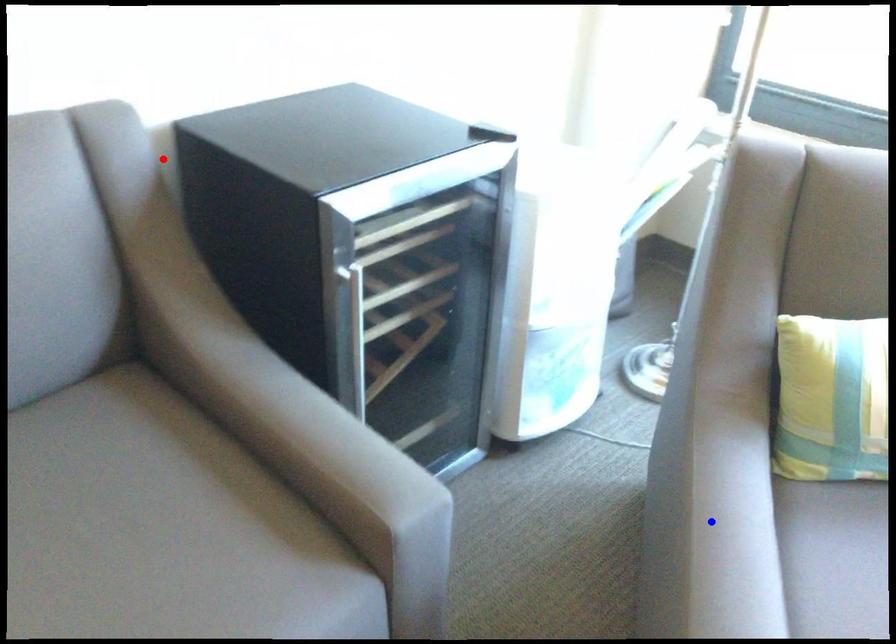
Question: Two points are marked on the image. Which point is closer to the camera?

Choices:
 (A) Blue point is closer.
 (B) Red point is closer.

Answer: (A)